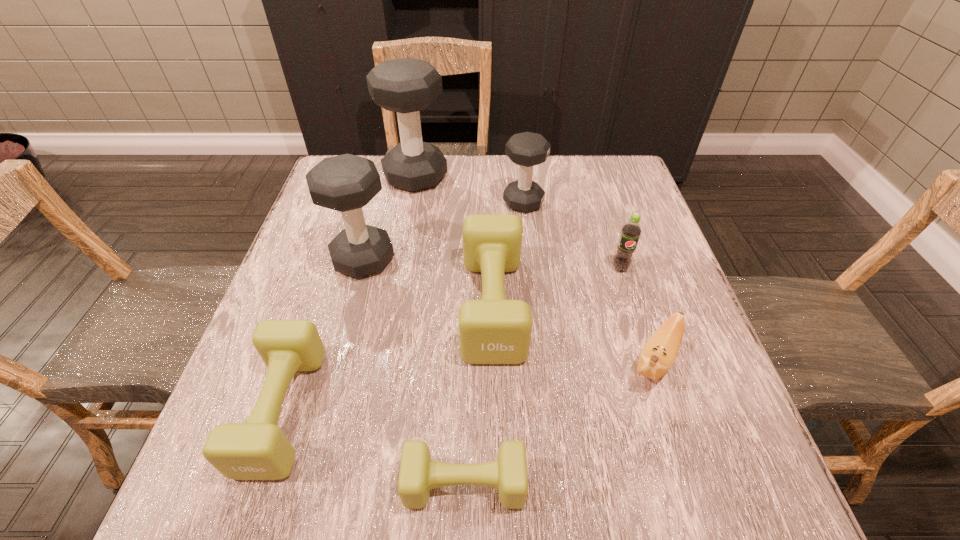
Select which object appears as the closest to the tallest object. Please provide its 2D coordinates. Your answer should be formatted as a tuple, i.e. [(x, y)], where the tuple contains the x and y coordinates of a point satisfying the conditions above.

[(527, 149)]

Where is `dumbbell that stands as the fourth closest to the yellow banana`? The height and width of the screenshot is (540, 960). dumbbell that stands as the fourth closest to the yellow banana is located at coordinates (346, 183).

Select which dumbbell appears as the second closest to the leftmost olive dumbbell. Please provide its 2D coordinates. Your answer should be formatted as a tuple, i.e. [(x, y)], where the tuple contains the x and y coordinates of a point satisfying the conditions above.

[(346, 183)]

The image size is (960, 540). I want to click on gray dumbbell object that ranks as the closest to the third tallest object, so click(407, 86).

You are a GUI agent. You are given a task and a screenshot of the screen. Output one action in this format:
    pyautogui.click(x=<x>, y=<y>)
    Task: Click on the gray dumbbell that stands as the second closest to the smallest olive dumbbell
    The width and height of the screenshot is (960, 540).
    Given the screenshot: What is the action you would take?
    (527, 149)

The height and width of the screenshot is (540, 960). I want to click on olive dumbbell that is the closest to the shortest dumbbell, so click(493, 330).

Locate which olive dumbbell is the third closest to the tallest object. Please provide its 2D coordinates. Your answer should be formatted as a tuple, i.e. [(x, y)], where the tuple contains the x and y coordinates of a point satisfying the conditions above.

[(418, 474)]

Find the location of a particular element. Image resolution: width=960 pixels, height=540 pixels. free space in the image that satisfies the following two spatial constraints: 1. on the back side of the yellow banana; 2. on the right side of the second biggest olive dumbbell is located at coordinates (300, 360).

Where is `vacant space that satisfies the following two spatial constraints: 1. on the front label of the green soda; 2. on the left side of the banana`? This screenshot has height=540, width=960. vacant space that satisfies the following two spatial constraints: 1. on the front label of the green soda; 2. on the left side of the banana is located at coordinates (649, 360).

You are a GUI agent. You are given a task and a screenshot of the screen. Output one action in this format:
    pyautogui.click(x=<x>, y=<y>)
    Task: Click on the free location that satisfies the following two spatial constraints: 1. on the back side of the biggest gray dumbbell; 2. on the left side of the fifth tallest dumbbell
    
    Given the screenshot: What is the action you would take?
    pyautogui.click(x=360, y=177)